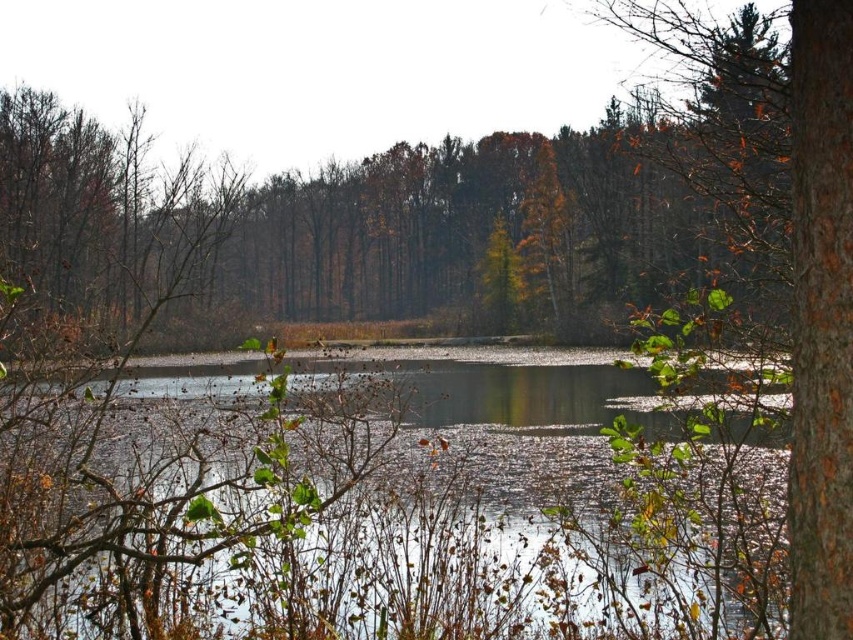
Question: In this image, where is clear water at center located relative to brown rough bark tree at right?

Choices:
 (A) left
 (B) right

Answer: (A)

Question: Is clear water at center behind brown rough bark tree at right?

Choices:
 (A) yes
 (B) no

Answer: (A)

Question: In this image, where is clear water at center located relative to brown rough bark tree at right?

Choices:
 (A) above
 (B) below

Answer: (B)

Question: Among these objects, which one is nearest to the camera?

Choices:
 (A) clear water at center
 (B) brown rough bark tree at right

Answer: (B)